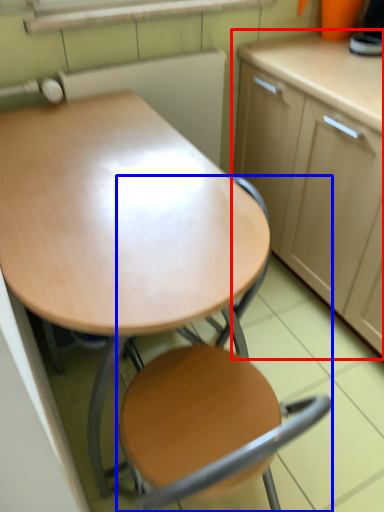
Question: Which object appears farthest to the camera in this image, cabinetry (highlighted by a red box) or chair (highlighted by a blue box)?

Choices:
 (A) cabinetry
 (B) chair

Answer: (A)